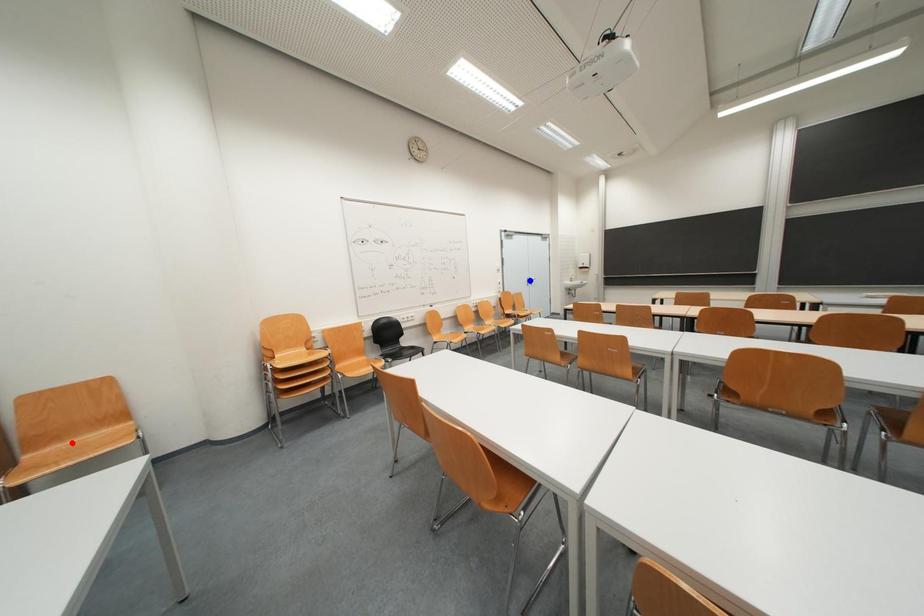
Question: Which of the two points in the image is closer to the camera?

Choices:
 (A) Blue point is closer.
 (B) Red point is closer.

Answer: (B)